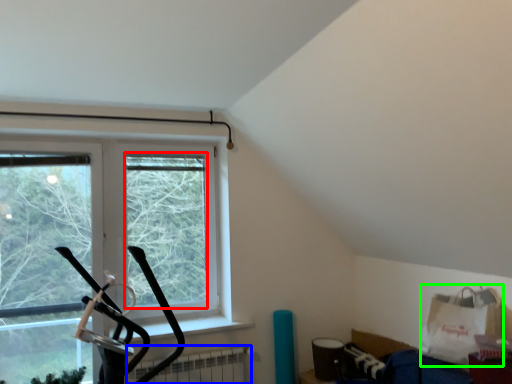
Question: Which object is the farthest from window screen (highlighted by a red box)? Choose among these: radiator (highlighted by a blue box) or grocery bag (highlighted by a green box).

Choices:
 (A) radiator
 (B) grocery bag

Answer: (B)